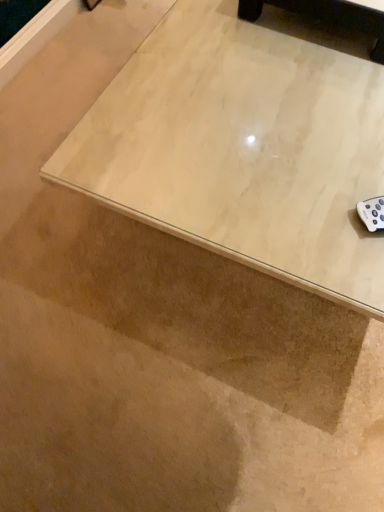
The height and width of the screenshot is (512, 384). Identify the location of free space above light wood table at upper right (from a real-world perspective). (274, 80).